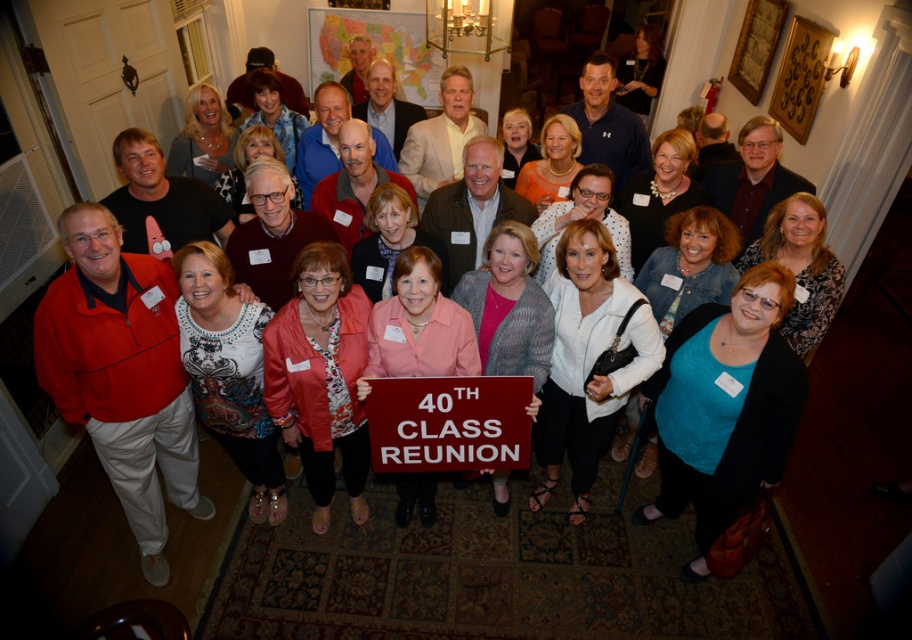
You are a photographer taking a group photo of the matte black shirt at center and the light beige suit at center. Which person should you adjust to be closer to the camera to ensure both are in focus?

The matte black shirt at center has a lesser height compared to light beige suit at center, so you should adjust the light beige suit at center to be closer to the camera to ensure both are in focus.

You are a photographer trying to capture a group photo of the maroon plastic sign at center and the light beige suit at center. Which object should you focus on first if you want to ensure both are in focus without adjusting the camera settings?

The maroon plastic sign at center is shorter than light beige suit at center, so you should focus on the light beige suit at center first since it is farther away. This will ensure both objects are within the depth of field.

You are a photographer at the 40th class reunion. You need to take a photo of the matte black shirt at center and the light beige suit at center. Which one is on the left side when facing the group?

The light beige suit at center is on the left side because the matte black shirt at center is to the right of it.